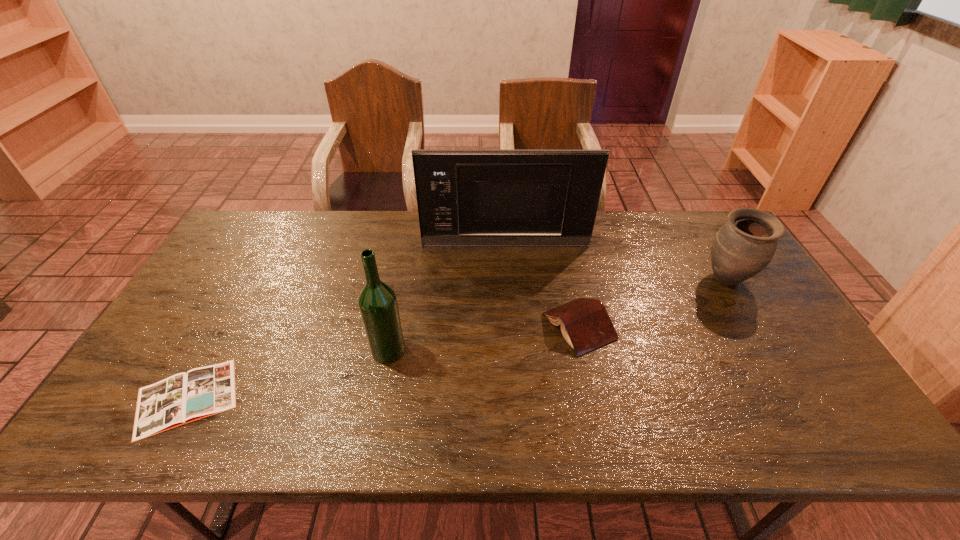
The height and width of the screenshot is (540, 960). What are the coordinates of `microwave oven` in the screenshot? It's located at (478, 198).

Identify the location of the fourth object from right to left. (378, 306).

The height and width of the screenshot is (540, 960). In order to click on urn in this screenshot , I will do `click(746, 243)`.

The height and width of the screenshot is (540, 960). Identify the location of the rightmost object. (746, 243).

Locate an element on the screen. The width and height of the screenshot is (960, 540). the farther book is located at coordinates (585, 324).

Locate an element on the screen. The width and height of the screenshot is (960, 540). the taller book is located at coordinates (585, 324).

Identify the location of the shortest object. The width and height of the screenshot is (960, 540). (182, 398).

Find the location of a particular element. This screenshot has height=540, width=960. the left book is located at coordinates (182, 398).

The height and width of the screenshot is (540, 960). What are the coordinates of `vacant region located 0.400m on the front panel of the microwave oven` in the screenshot? It's located at (513, 343).

You are a GUI agent. You are given a task and a screenshot of the screen. Output one action in this format:
    pyautogui.click(x=<x>, y=<y>)
    Task: Click on the vacant region located on the right of the alcohol
    The width and height of the screenshot is (960, 540).
    Given the screenshot: What is the action you would take?
    pyautogui.click(x=478, y=350)